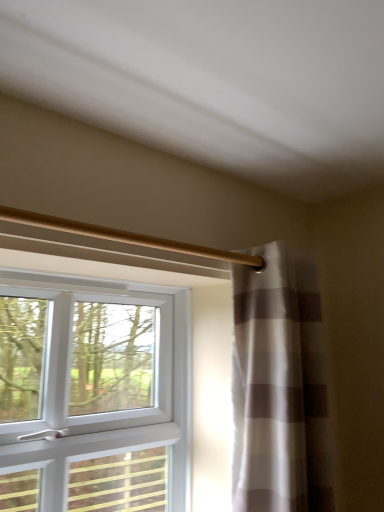
Image resolution: width=384 pixels, height=512 pixels. Find the location of `white plastic window at left`. white plastic window at left is located at coordinates (98, 392).

Identify the location of gold metallic curtain rod at upper center. The height and width of the screenshot is (512, 384). pos(126,237).

Where is `white striped curtain at right`? white striped curtain at right is located at coordinates (267, 387).

You are a GUI agent. You are given a task and a screenshot of the screen. Output one action in this format:
    pyautogui.click(x=<x>, y=<y>)
    Task: Click on the white plastic window at left
    
    Given the screenshot: What is the action you would take?
    click(98, 392)

From the image's perspective, is white striped curtain at right above gold metallic curtain rod at upper center?

No, from the image's perspective, white striped curtain at right is not over gold metallic curtain rod at upper center.

How much distance is there between white striped curtain at right and gold metallic curtain rod at upper center?

white striped curtain at right and gold metallic curtain rod at upper center are 12.95 inches apart.

Is white striped curtain at right in front of or behind gold metallic curtain rod at upper center in the image?

white striped curtain at right is positioned farther from the viewer than gold metallic curtain rod at upper center.

Looking at this image, can you tell me how much white striped curtain at right and gold metallic curtain rod at upper center differ in facing direction?

white striped curtain at right and gold metallic curtain rod at upper center are facing 0.0096 degrees away from each other.

Who is taller, white plastic window at left or white striped curtain at right?

white striped curtain at right is taller.

From a real-world perspective, who is located lower, white plastic window at left or white striped curtain at right?

From a 3D spatial view, white plastic window at left is below.

Is white plastic window at left facing away from white striped curtain at right?

white plastic window at left does not have its back to white striped curtain at right.

In the scene shown: Is white plastic window at left to the left or to the right of white striped curtain at right in the image?

Based on their positions, white plastic window at left is located to the left of white striped curtain at right.

In the scene shown: Which of these two, gold metallic curtain rod at upper center or white plastic window at left, is bigger?

white plastic window at left.

In the scene shown: Is white plastic window at left surrounded by gold metallic curtain rod at upper center?

No, white plastic window at left is located outside of gold metallic curtain rod at upper center.

Considering the positions of objects gold metallic curtain rod at upper center and white plastic window at left in the image provided, who is more to the left, gold metallic curtain rod at upper center or white plastic window at left?

white plastic window at left is more to the left.

Are white striped curtain at right and white plastic window at left making contact?

No, white striped curtain at right is not beside white plastic window at left.

Based on the photo, what's the angular difference between white striped curtain at right and white plastic window at left's facing directions?

white striped curtain at right and white plastic window at left are facing 0.0046 degrees away from each other.

The image size is (384, 512). I want to click on window below the white striped curtain at right (from a real-world perspective), so click(x=98, y=392).

Can we say white striped curtain at right lies outside white plastic window at left?

white striped curtain at right is positioned outside white plastic window at left.

In the scene shown: Considering the relative sizes of gold metallic curtain rod at upper center and white striped curtain at right in the image provided, is gold metallic curtain rod at upper center taller than white striped curtain at right?

In fact, gold metallic curtain rod at upper center may be shorter than white striped curtain at right.

Does gold metallic curtain rod at upper center appear on the left side of white striped curtain at right?

Yes.

Which is nearer, [173,246] or [261,429]?

Clearly, point [173,246] is closer to the camera than point [261,429].

Considering the sizes of objects gold metallic curtain rod at upper center and white striped curtain at right in the image provided, who is wider, gold metallic curtain rod at upper center or white striped curtain at right?

Wider between the two is white striped curtain at right.

Does point (146, 387) come behind point (118, 236)?

Yes, it is behind point (118, 236).

Which of these two, white plastic window at left or gold metallic curtain rod at upper center, stands taller?

white plastic window at left is taller.

Is white plastic window at left oriented away from gold metallic curtain rod at upper center?

white plastic window at left is not turned away from gold metallic curtain rod at upper center.

How much distance is there between white plastic window at left and gold metallic curtain rod at upper center?

50.61 centimeters.

You are a GUI agent. You are given a task and a screenshot of the screen. Output one action in this format:
    pyautogui.click(x=<x>, y=<y>)
    Task: Click on the curtain on the right of the gold metallic curtain rod at upper center
    Image resolution: width=384 pixels, height=512 pixels.
    Given the screenshot: What is the action you would take?
    pyautogui.click(x=267, y=387)

Find the location of a particular element. Image resolution: width=384 pixels, height=512 pixels. curtain behind the white plastic window at left is located at coordinates (267, 387).

Considering their positions, is gold metallic curtain rod at upper center positioned closer to white striped curtain at right than white plastic window at left?

gold metallic curtain rod at upper center is closer to white striped curtain at right.

Considering their positions, is white striped curtain at right positioned closer to white plastic window at left than gold metallic curtain rod at upper center?

Based on the image, white striped curtain at right appears to be nearer to white plastic window at left.

When comparing their distances from gold metallic curtain rod at upper center, does white plastic window at left or white striped curtain at right seem further?

white plastic window at left lies further to gold metallic curtain rod at upper center than the other object.

Considering their positions, is gold metallic curtain rod at upper center positioned closer to white plastic window at left than white striped curtain at right?

Based on the image, white striped curtain at right appears to be nearer to white plastic window at left.

Estimate the real-world distances between objects in this image. Which object is closer to white striped curtain at right, white plastic window at left or gold metallic curtain rod at upper center?

Based on the image, gold metallic curtain rod at upper center appears to be nearer to white striped curtain at right.

Estimate the real-world distances between objects in this image. Which object is closer to gold metallic curtain rod at upper center, white striped curtain at right or white plastic window at left?

white striped curtain at right is positioned closer to the anchor gold metallic curtain rod at upper center.

Identify the location of beam between white plastic window at left and white striped curtain at right. The image size is (384, 512). tap(126, 237).